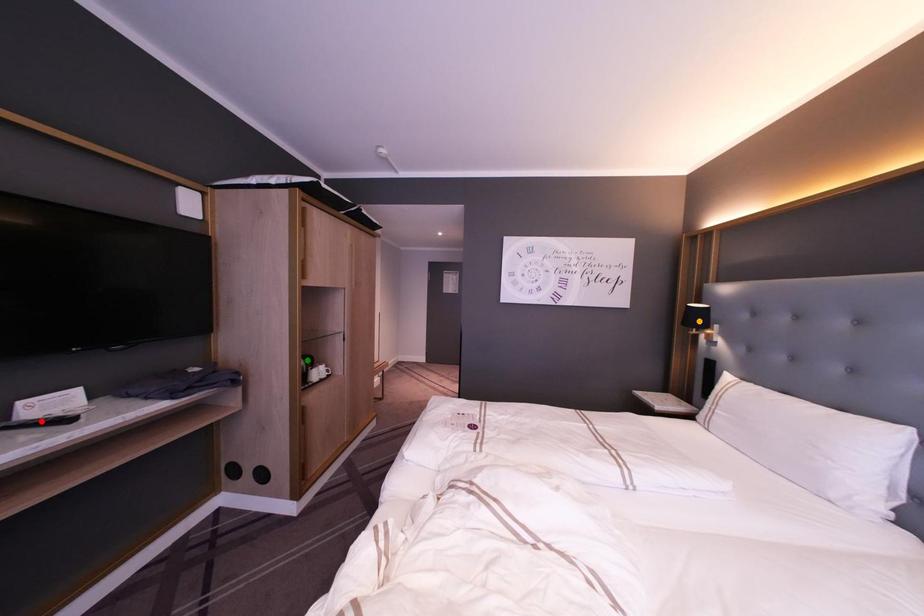
Order these from nearest to farthest:
- orange point
- red point
- green point

red point
orange point
green point